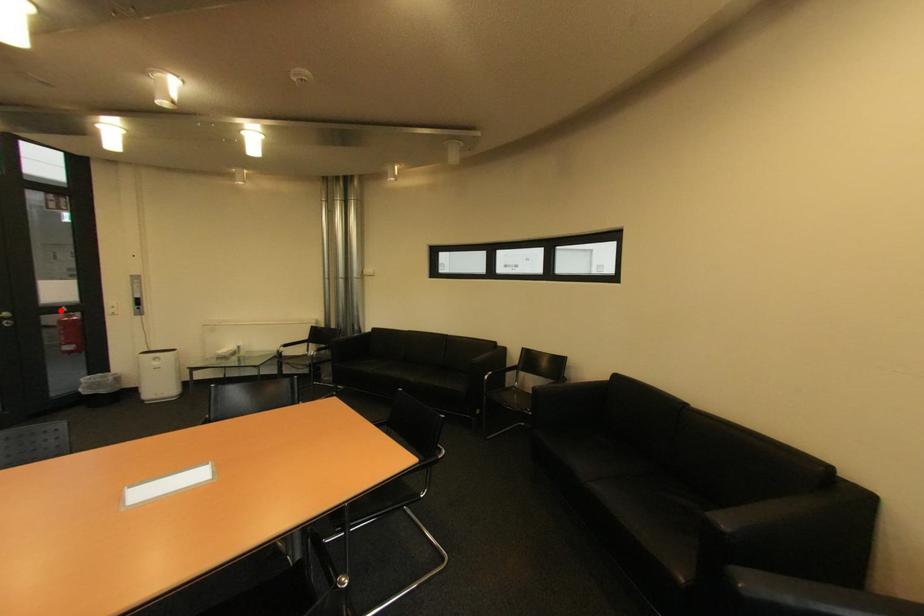
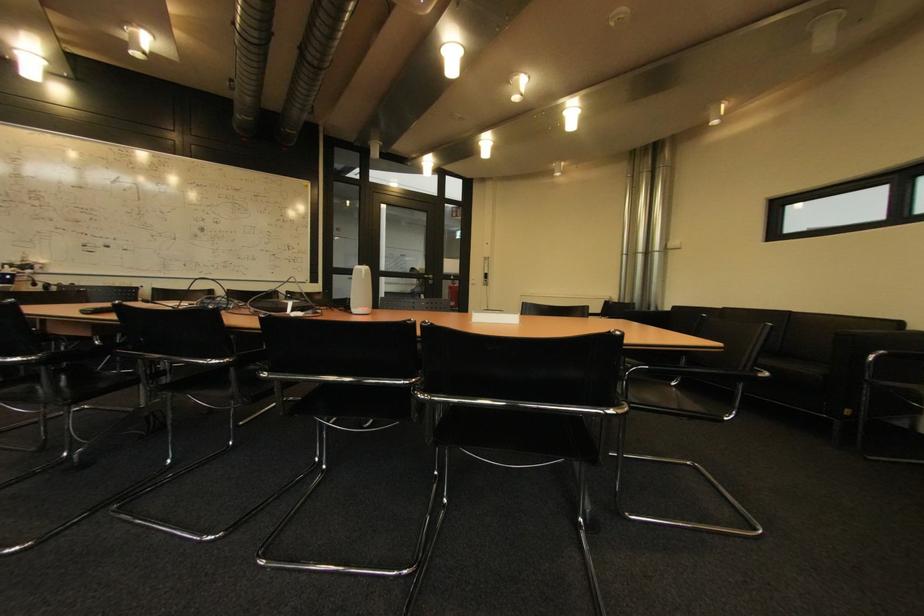
Question: I am providing you with two images of the same scene from different viewpoints. A red point is shown in image1. For the corresponding object point in image2, is it positioned nearer or farther from the camera?

Choices:
 (A) Nearer
 (B) Farther

Answer: (A)